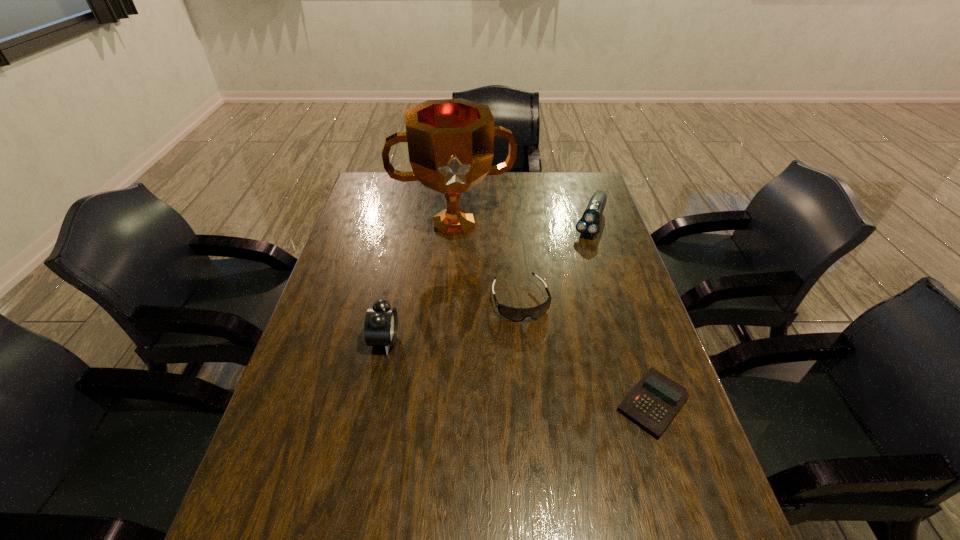
Where is `alarm clock`? The height and width of the screenshot is (540, 960). alarm clock is located at coordinates (381, 322).

The image size is (960, 540). Identify the location of the fourth farthest object. (381, 322).

I want to click on the nearest object, so click(x=654, y=401).

Locate an element on the screen. The image size is (960, 540). calculator is located at coordinates (654, 401).

This screenshot has height=540, width=960. I want to click on electric shaver, so click(588, 225).

I want to click on award, so click(x=450, y=142).

Identify the location of the third farthest object. (x=515, y=314).

In order to click on goggles in this screenshot , I will do `click(515, 314)`.

Where is `free space located 0.190m on the front side of the alarm clock`? free space located 0.190m on the front side of the alarm clock is located at coordinates (470, 341).

You are a GUI agent. You are given a task and a screenshot of the screen. Output one action in this format:
    pyautogui.click(x=<x>, y=<y>)
    Task: Click on the free location located 0.300m on the left of the calculator
    
    Given the screenshot: What is the action you would take?
    (x=484, y=403)